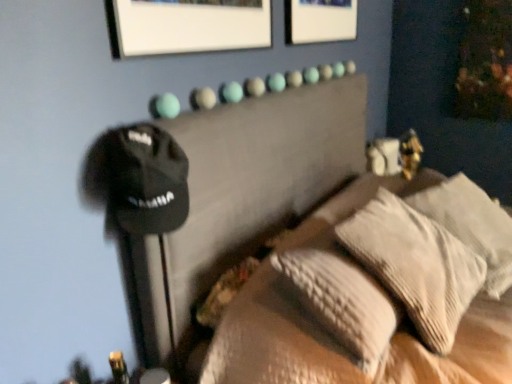
Question: Is textured beige pillows at center outside of textured beige pillow at center, the second pillow from the right?

Choices:
 (A) yes
 (B) no

Answer: (B)

Question: Can textured beige pillow at center, which is the first pillow from left to right, be found inside textured beige pillows at center?

Choices:
 (A) no
 (B) yes

Answer: (B)

Question: Can you confirm if textured beige pillows at center is taller than textured beige pillow at center, the second pillow from the right?

Choices:
 (A) no
 (B) yes

Answer: (A)

Question: Does textured beige pillows at center come in front of textured beige pillow at center, the second pillow from the right?

Choices:
 (A) yes
 (B) no

Answer: (A)

Question: Is textured beige pillows at center facing towards textured beige pillow at center, which is the first pillow from left to right?

Choices:
 (A) no
 (B) yes

Answer: (B)

Question: Is textured beige pillows at center next to textured beige pillow at center, the second pillow from the right, and touching it?

Choices:
 (A) no
 (B) yes

Answer: (B)

Question: Is textured beige pillows at center next to white textured pillow at right, which is the second pillow from left to right?

Choices:
 (A) yes
 (B) no

Answer: (B)

Question: From a real-world perspective, is textured beige pillows at center physically below white textured pillow at right, which is the second pillow from left to right?

Choices:
 (A) yes
 (B) no

Answer: (B)

Question: Is textured beige pillows at center closer to camera compared to white textured pillow at right, which is the second pillow from left to right?

Choices:
 (A) yes
 (B) no

Answer: (A)

Question: Considering the relative positions of textured beige pillows at center and white textured pillow at right, the first pillow positioned from the right, in the image provided, is textured beige pillows at center to the right of white textured pillow at right, the first pillow positioned from the right, from the viewer's perspective?

Choices:
 (A) no
 (B) yes

Answer: (A)

Question: Can you confirm if textured beige pillows at center is smaller than white textured pillow at right, which is the second pillow from left to right?

Choices:
 (A) yes
 (B) no

Answer: (B)

Question: Could you tell me if textured beige pillows at center is facing white textured pillow at right, which is the second pillow from left to right?

Choices:
 (A) yes
 (B) no

Answer: (B)

Question: From the image's perspective, is white textured pillow at right, the first pillow positioned from the right, below textured beige pillow at center, the second pillow from the right?

Choices:
 (A) yes
 (B) no

Answer: (B)